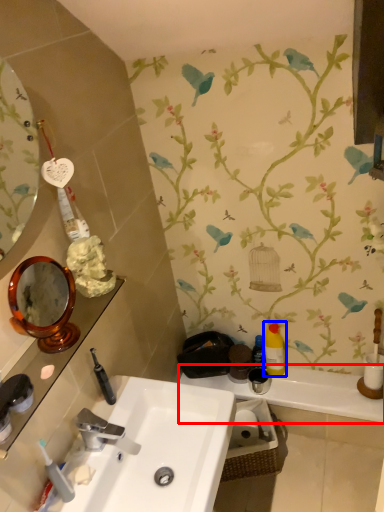
Question: Which point is further to the camera, counter top (highlighted by a red box) or mouthwash (highlighted by a blue box)?

Choices:
 (A) counter top
 (B) mouthwash

Answer: (B)